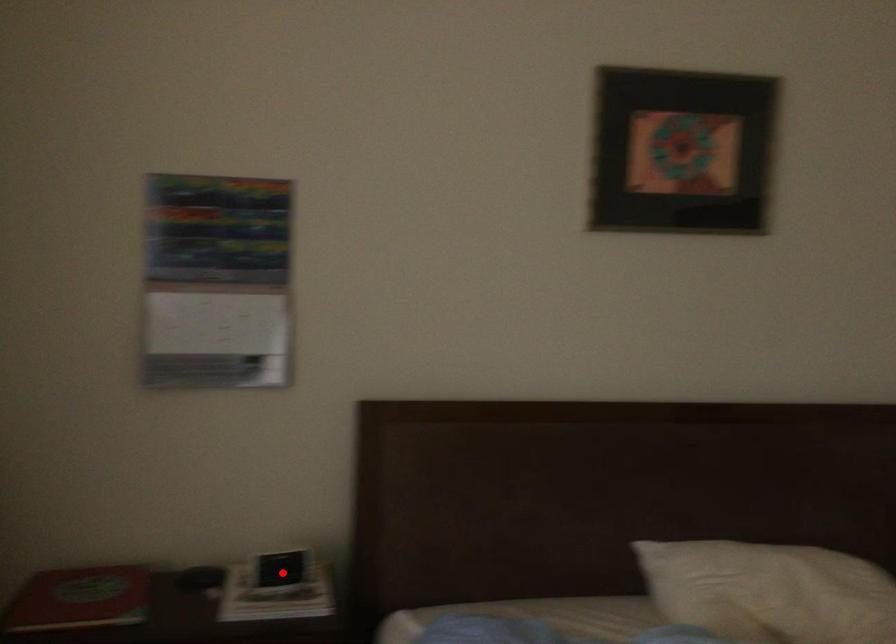
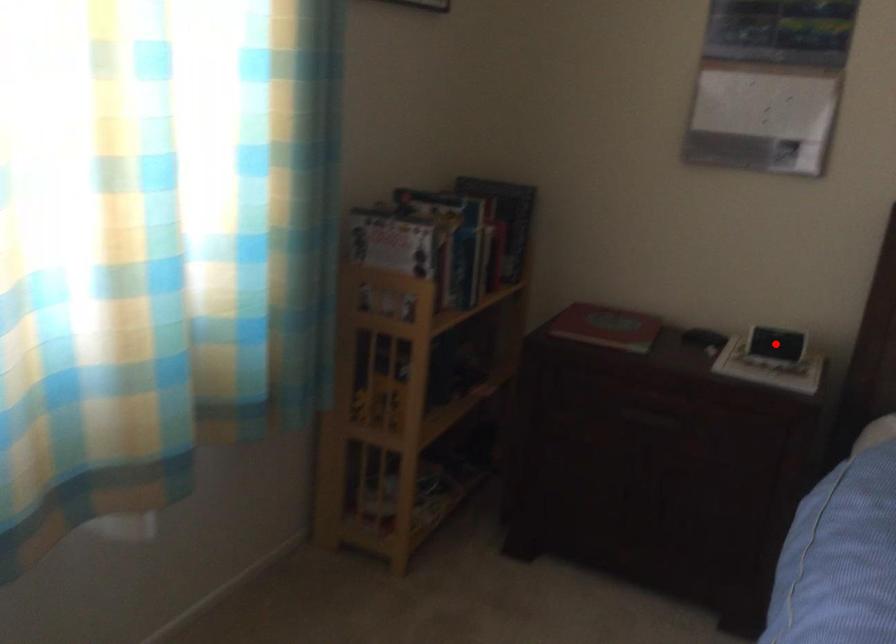
I am providing you with two images of the same scene from different viewpoints. A red point is marked on the first image and another point is marked on the second image. Does the point marked in image1 correspond to the same location as the one in image2?

Yes